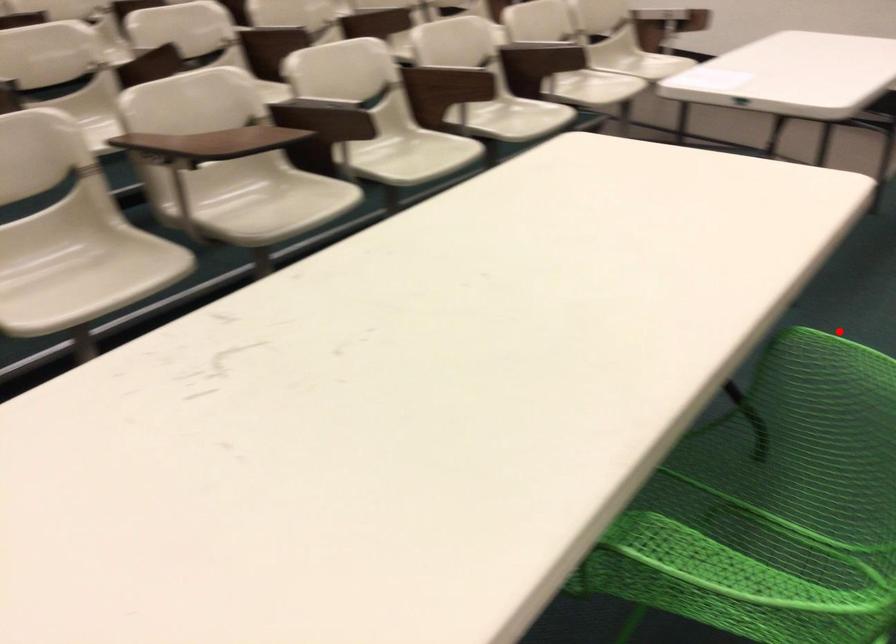
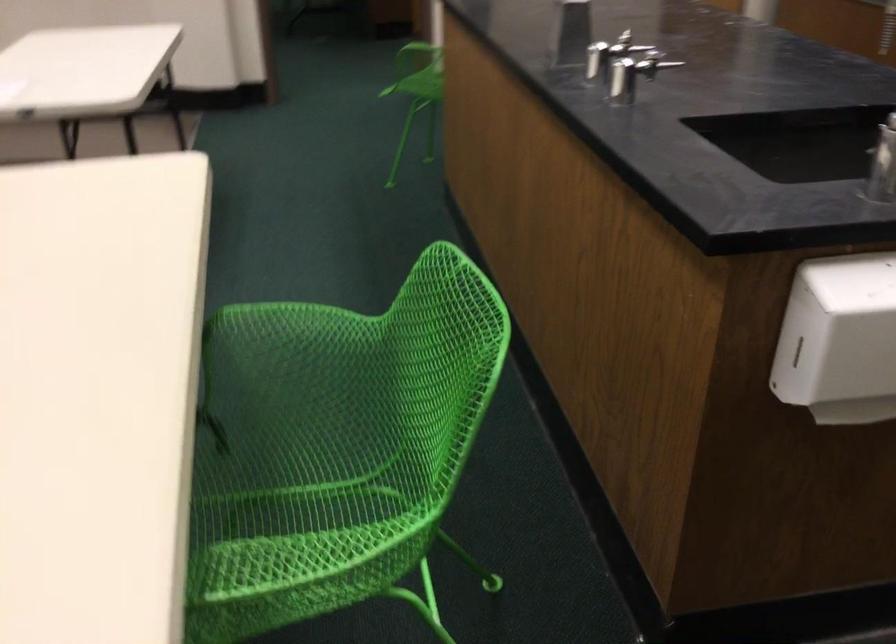
Question: I am providing you with two images of the same scene from different viewpoints. A red point is marked on the first image. Can you still see the location of the red point in image 2?

Choices:
 (A) Yes
 (B) No

Answer: (B)